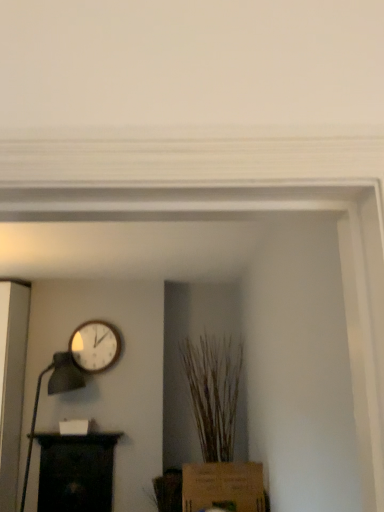
Question: From their relative heights in the image, would you say brown cardboard box at lower center is taller or shorter than matte black table lamp at left?

Choices:
 (A) tall
 (B) short

Answer: (B)

Question: Looking at the image, does brown cardboard box at lower center seem bigger or smaller compared to matte black table lamp at left?

Choices:
 (A) small
 (B) big

Answer: (A)

Question: Which is farther from the matte black table lamp at left?

Choices:
 (A) wooden wall clock at upper left
 (B) brown textured plant at center
 (C) brown cardboard box at lower center
 (D) black wood shelf at lower left

Answer: (C)

Question: Which object is positioned closest to the black wood shelf at lower left?

Choices:
 (A) matte black table lamp at left
 (B) brown cardboard box at lower center
 (C) wooden wall clock at upper left
 (D) brown textured plant at center

Answer: (A)